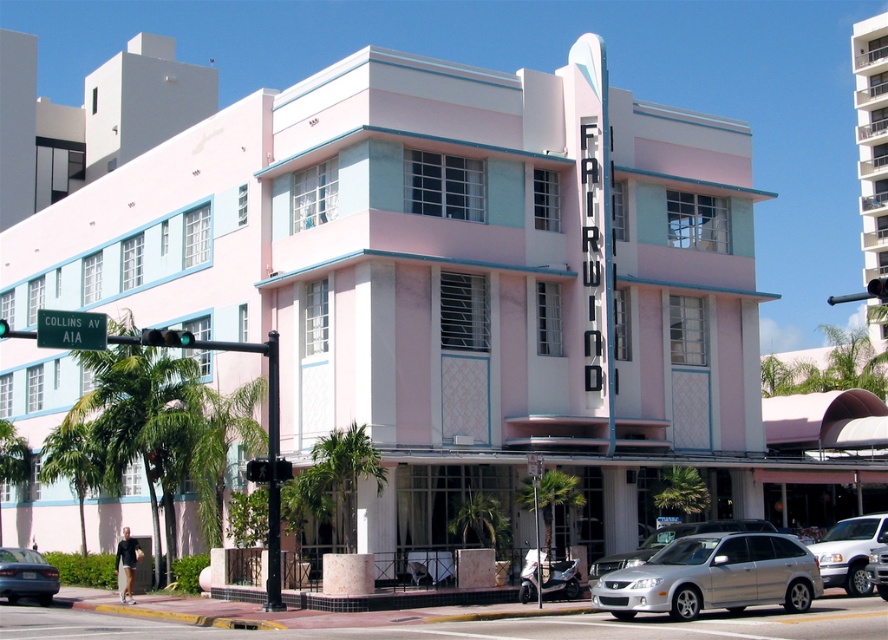
Consider the image. You are a delivery person approaching the FAIRWIND building. You need to park your delivery van between the green leafy palm tree at lower center and the green glass traffic light at left. Can the van fit between them if the van is 2 meters wide?

The green leafy palm tree at lower center is wider than the green glass traffic light at left. However, the exact width of the space between them isn

You are a delivery person arriving at the FAIRWIND building. You need to park your silver metallic scooter at lower center near the entrance. However, there is a green leafy palm tree at center in the way. Can you park the scooter there without moving the tree?

The green leafy palm tree at center is located above the silver metallic scooter at lower center, meaning the palm tree is positioned higher up, possibly above the scooter area. Therefore, the scooter can be parked there as the tree is not blocking the ground space.